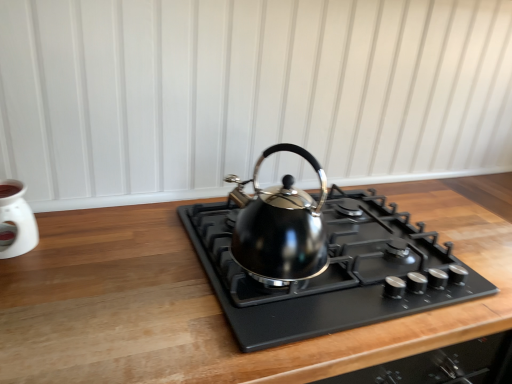
Find the location of a particular element. The width and height of the screenshot is (512, 384). free location to the right of white glossy oil burner at left is located at coordinates (95, 254).